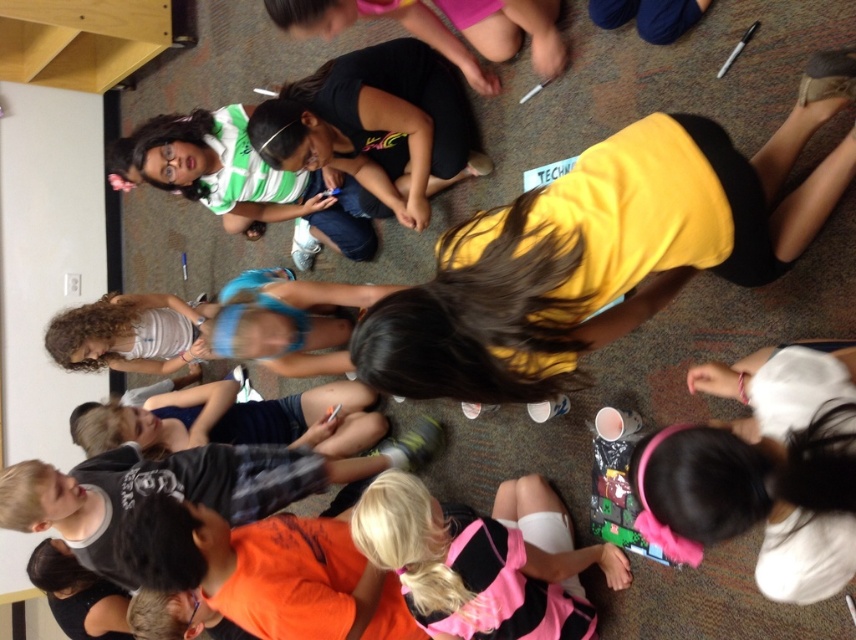
You are standing in the classroom and want to take a photo of the point at coordinates (435, 509). The camera you are using has a minimum focus distance of 1.6 meters. Will the camera be able to focus on the point?

The point at coordinates (435, 509) is 1.59 meters from the camera, which is slightly closer than the minimum focus distance of 1.6 meters. Therefore, the camera may not be able to focus on the point.

You are a teacher standing at the front of the classroom. You need to hand out materials to the pink fabric at lower center and the orange matte shirt at center. Which object should you reach for first to ensure you can easily access both?

You should reach for the pink fabric at lower center first because it is closer to you than the orange matte shirt at center, allowing you to access both more easily.